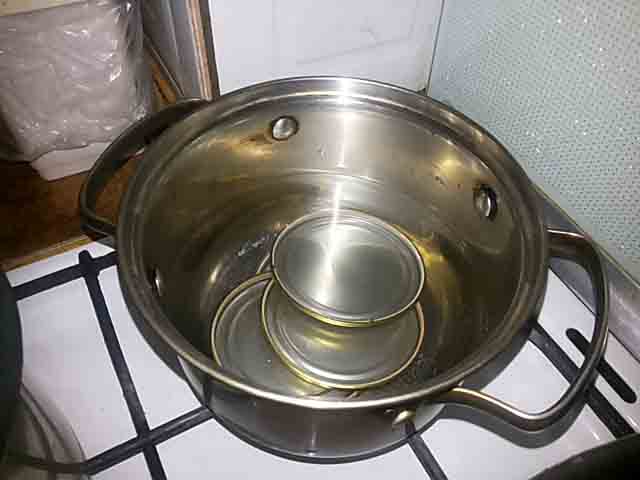
Where is `lids inside pot`? This screenshot has height=480, width=640. lids inside pot is located at coordinates (333, 279), (310, 351), (248, 348).